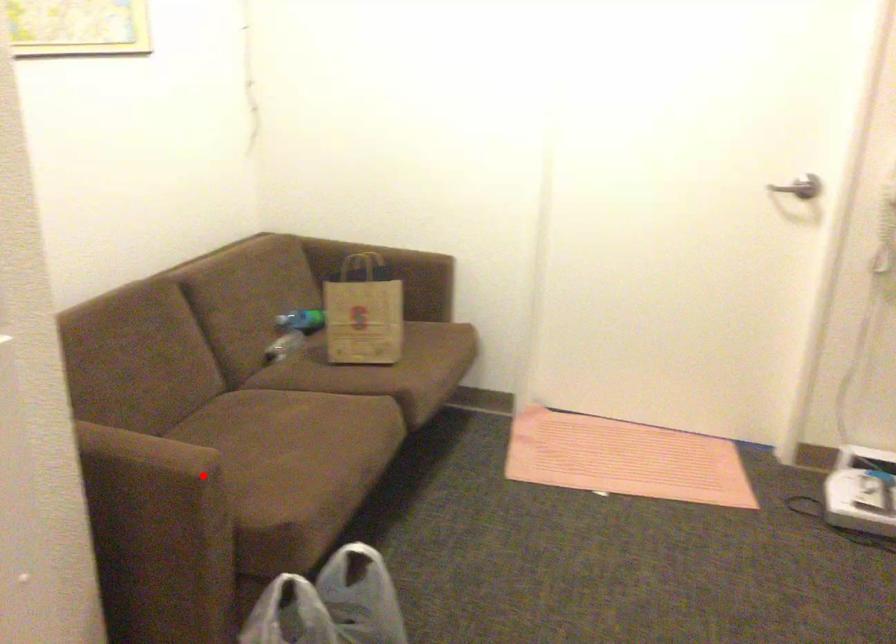
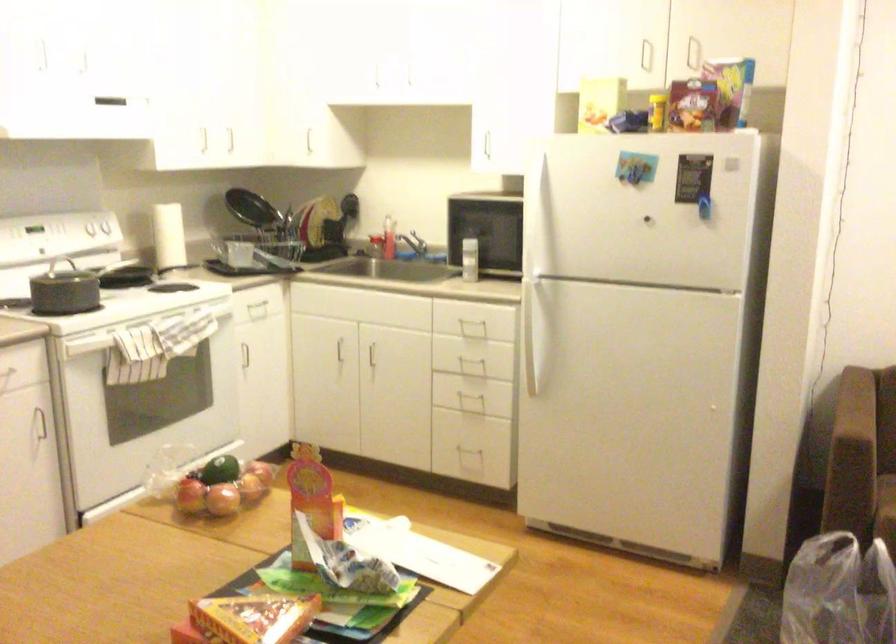
Question: I am providing you with two images of the same scene from different viewpoints. In image1, a red point is highlighted. Considering the same 3D point in image2, which of the following is correct?

Choices:
 (A) It is closer
 (B) It is farther

Answer: (B)